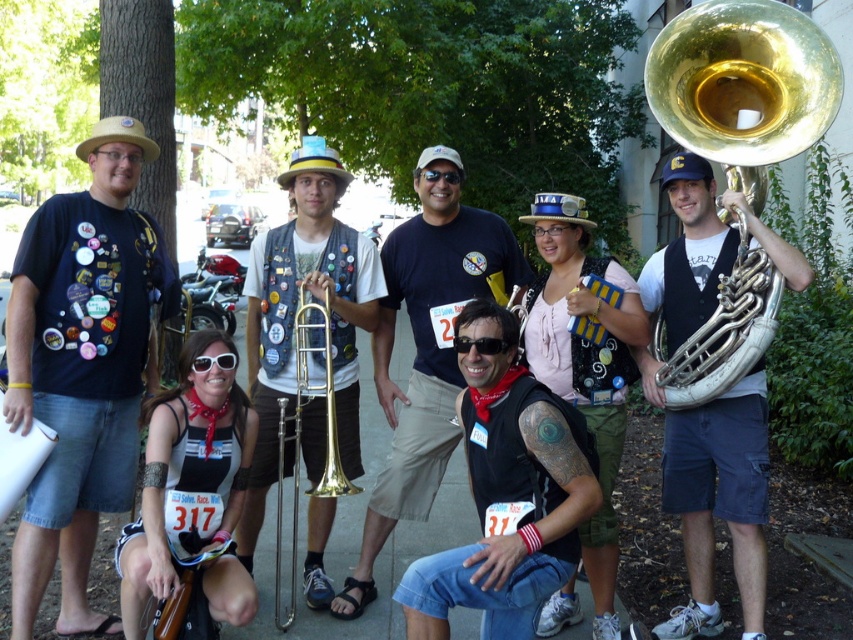
You are a photographer holding a camera and want to take a picture of the silver metallic tuba at center from a distance where you can clearly capture its details without distortion. Given that you are currently 12.20 feet away, is this distance suitable for a clear, undistorted photo?

The silver metallic tuba at center and camera are 12.20 feet apart from each other. This distance should be suitable for taking a clear, undistorted photo as most standard camera lenses can capture details effectively at this range without significant distortion.

You are a musician standing in the middle of the park. You see the silver metallic tuba at center and the shiny brass trombone at center. Which instrument is positioned lower in the image?

The silver metallic tuba at center is positioned below the shiny brass trombone at center, so it is lower in the image.

You are standing in the park where the group is gathered. You see two points marked in the image. One is at coordinate point (506, 241) and the other is at point (177, 596). Which point is closer to you?

Point (177, 596) is closer to you because it is less further to the camera than point (506, 241).